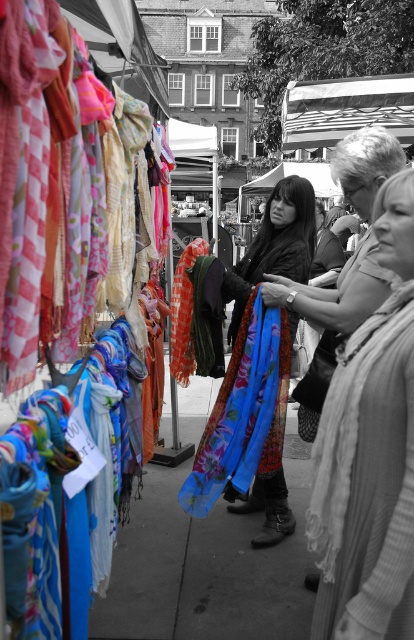
You are a customer at the market and want to buy the blue floral scarf at center. You notice there is a blue fabric at center below it. Can you tell me which item is closer to you?

The blue fabric at center is positioned under the blue floral scarf at center, meaning the blue floral scarf at center is closer to you.

You are a delivery person carrying a box that is 2 meters long. You need to place it between the knitted sweater at center and the blue fabric at center. Can you fit the box between them without bending it?

The distance between the knitted sweater at center and the blue fabric at center is 2.01 meters, so the box can be placed between them as the space is slightly larger than the box length.